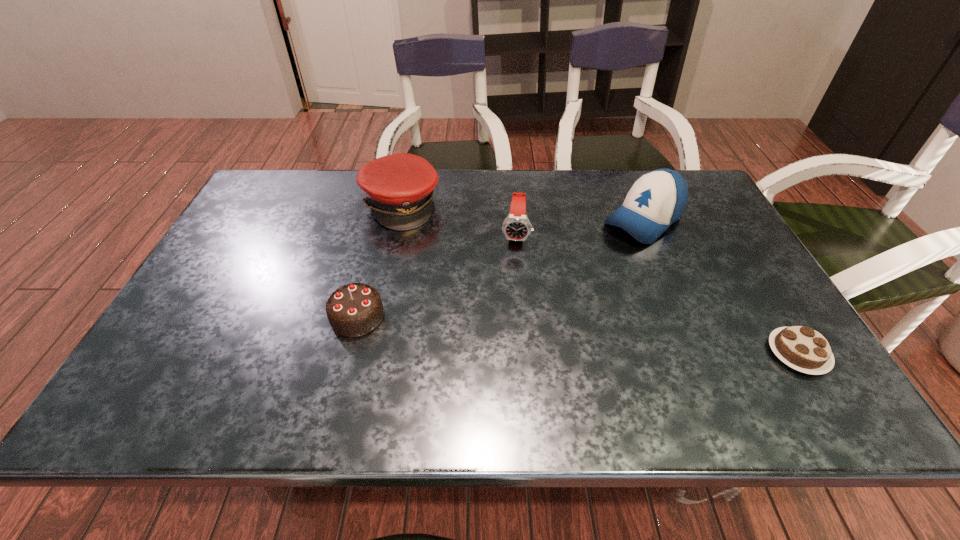
Find the location of `object at the near edge`. object at the near edge is located at coordinates (801, 348).

At what (x,y) coordinates should I click in order to perform the action: click on chocolate cake located at the right edge. Please return your answer as a coordinate pair (x, y). This screenshot has height=540, width=960. Looking at the image, I should click on (801, 348).

The width and height of the screenshot is (960, 540). What are the coordinates of `baseball cap present at the right edge` in the screenshot? It's located at (657, 199).

I want to click on object at the far right corner, so click(657, 199).

Locate an element on the screen. This screenshot has width=960, height=540. object situated at the near right corner is located at coordinates (801, 348).

In the image, there is a desktop. In order to click on vacant space at the far edge in this screenshot , I will do `click(494, 207)`.

Locate an element on the screen. The width and height of the screenshot is (960, 540). free point at the near edge is located at coordinates (699, 367).

Identify the location of free region at the left edge of the desktop. The height and width of the screenshot is (540, 960). (254, 236).

What are the coordinates of `vacant space at the right edge` in the screenshot? It's located at (741, 302).

Where is `free space at the far left corner`? The width and height of the screenshot is (960, 540). free space at the far left corner is located at coordinates (296, 172).